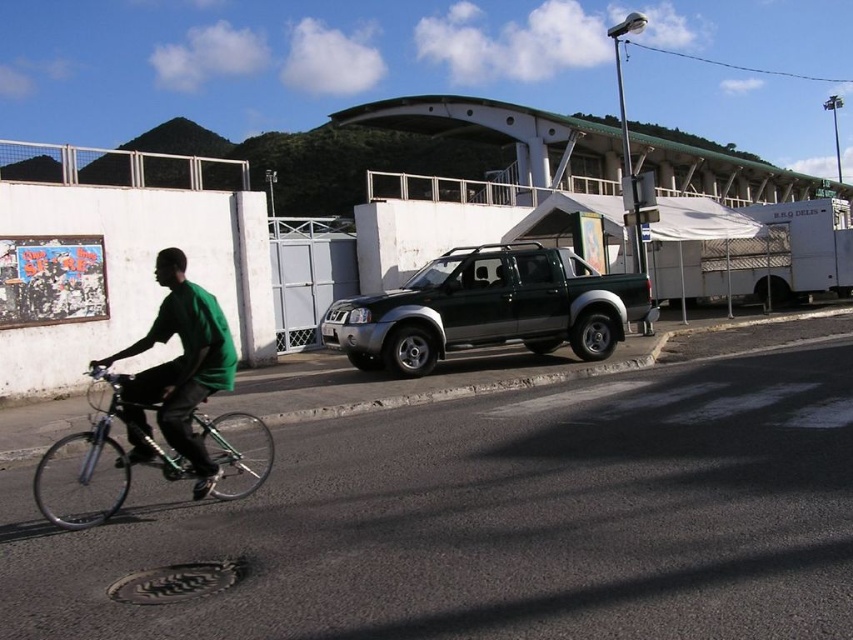
You are a pedestrian standing on the sidewalk and see the green matte shirt at left and the green matte truck at center. Which object is closer to you?

The green matte shirt at left is behind the green matte truck at center, so the truck is closer to you.

You are a photographer trying to capture the shiny metallic bicycle at lower left and the green matte shirt at left in a single shot. Considering their sizes, which object would require you to zoom out more to ensure both are fully visible?

The shiny metallic bicycle at lower left is wider than the green matte shirt at left, so you would need to zoom out more to include the entire bicycle in the frame.